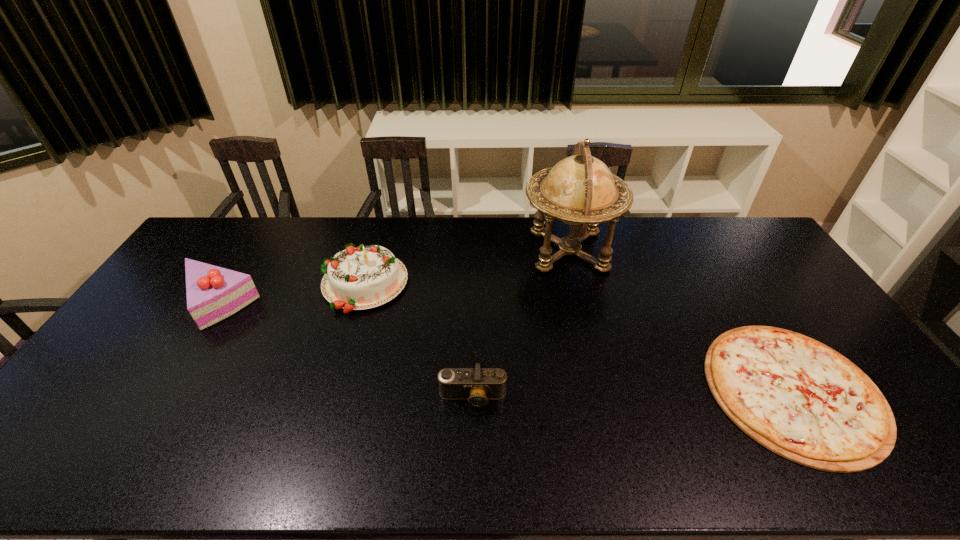
At what (x,y) coordinates should I click in order to perform the action: click on object situated at the left edge. Please return your answer as a coordinate pair (x, y). Looking at the image, I should click on (213, 293).

Find the location of `object situated at the right edge`. object situated at the right edge is located at coordinates (797, 397).

Find the location of a particular element. object that is at the near right corner is located at coordinates (797, 397).

You are a GUI agent. You are given a task and a screenshot of the screen. Output one action in this format:
    pyautogui.click(x=<x>, y=<y>)
    Task: Click on the vacant space at the far edge of the desktop
    The image size is (960, 540).
    Given the screenshot: What is the action you would take?
    pyautogui.click(x=639, y=222)

Identify the location of vacant area at the left edge of the desktop. (200, 258).

Identify the location of vacant space at the right edge of the desktop. This screenshot has width=960, height=540. (881, 392).

This screenshot has height=540, width=960. Find the location of `free spot between the shortest object and the fourth tallest object`. free spot between the shortest object and the fourth tallest object is located at coordinates coord(633,394).

Identify the location of unoccupied position between the globe and the fourth tallest object. The height and width of the screenshot is (540, 960). (520, 324).

The image size is (960, 540). I want to click on vacant point located between the rightmost object and the third shortest object, so click(506, 347).

Identify the location of vacant space in between the second object from right to left and the camera. (520, 324).